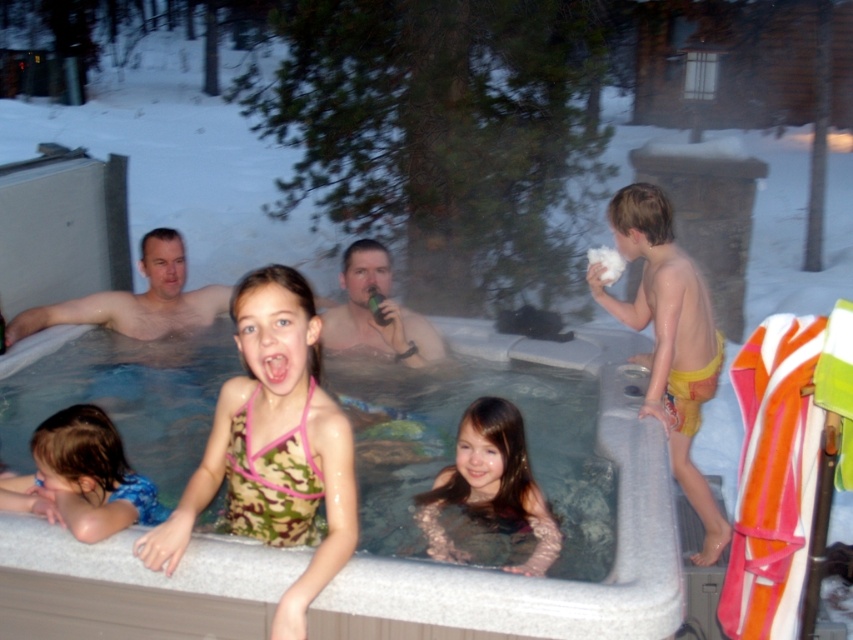
Question: Which of these objects is positioned farthest from the white plastic hot tub at center?

Choices:
 (A) smooth pink swimsuit at center
 (B) smooth skin man at left
 (C) smooth tan skin at center
 (D) camouflage halter top at center

Answer: (B)

Question: Does white plastic hot tub at center lie in front of yellow swim trunks at right?

Choices:
 (A) no
 (B) yes

Answer: (B)

Question: Among these points, which one is farthest from the camera?

Choices:
 (A) (207, 296)
 (B) (680, 460)
 (C) (404, 614)

Answer: (A)

Question: Among these points, which one is nearest to the camera?

Choices:
 (A) (392, 308)
 (B) (273, 582)
 (C) (277, 323)
 (D) (434, 490)

Answer: (C)

Question: Does camouflage halter top at center have a lesser width compared to smooth skin man at left?

Choices:
 (A) no
 (B) yes

Answer: (B)

Question: Can you confirm if smooth pink swimsuit at center is bigger than smooth skin man at left?

Choices:
 (A) yes
 (B) no

Answer: (B)